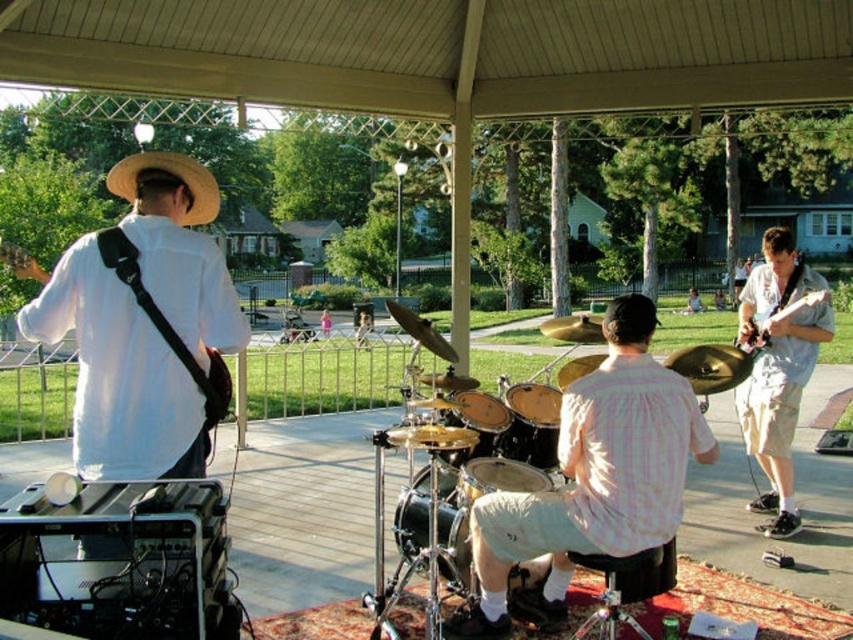
Question: Where is white matte guitar at left located in relation to matte brown drum at center in the image?

Choices:
 (A) above
 (B) below

Answer: (A)

Question: Among these points, which one is farthest from the camera?

Choices:
 (A) (506, 403)
 (B) (486, 452)
 (C) (187, 211)
 (D) (215, 273)

Answer: (A)

Question: Which point is farther from the camera taking this photo?

Choices:
 (A) (64, 257)
 (B) (492, 589)
 (C) (508, 416)

Answer: (C)

Question: Among these objects, which one is farthest from the camera?

Choices:
 (A) white matte guitar at left
 (B) straw hat at upper left

Answer: (B)

Question: Can you confirm if pink checkered shirt at center is positioned below matte brown drum at center?

Choices:
 (A) yes
 (B) no

Answer: (A)

Question: Is pink checkered shirt at center thinner than matte brown drum at center?

Choices:
 (A) yes
 (B) no

Answer: (B)